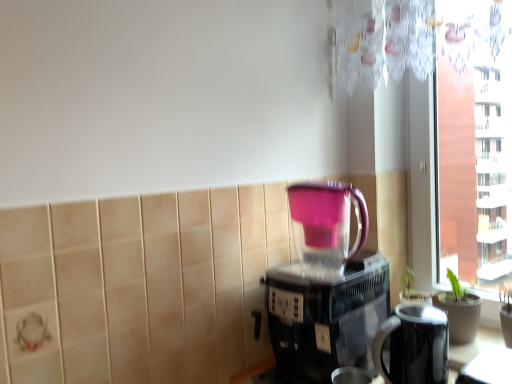
Question: Can you confirm if pink plastic blender at center is bigger than black glossy electric kettle at lower right?

Choices:
 (A) no
 (B) yes

Answer: (B)

Question: Is pink plastic blender at center smaller than black glossy electric kettle at lower right?

Choices:
 (A) no
 (B) yes

Answer: (A)

Question: Does pink plastic blender at center have a greater height compared to black glossy electric kettle at lower right?

Choices:
 (A) no
 (B) yes

Answer: (B)

Question: Can you confirm if pink plastic blender at center is shorter than black glossy electric kettle at lower right?

Choices:
 (A) yes
 (B) no

Answer: (B)

Question: From a real-world perspective, is pink plastic blender at center on black glossy electric kettle at lower right?

Choices:
 (A) yes
 (B) no

Answer: (A)

Question: From a real-world perspective, is pink plastic blender at center physically below black glossy electric kettle at lower right?

Choices:
 (A) yes
 (B) no

Answer: (B)

Question: From the image's perspective, would you say transparent glass window at right is positioned over pink plastic blender at center?

Choices:
 (A) no
 (B) yes

Answer: (B)

Question: Considering the relative sizes of transparent glass window at right and pink plastic blender at center in the image provided, is transparent glass window at right bigger than pink plastic blender at center?

Choices:
 (A) yes
 (B) no

Answer: (A)

Question: Does transparent glass window at right turn towards pink plastic blender at center?

Choices:
 (A) no
 (B) yes

Answer: (B)

Question: Is the depth of transparent glass window at right less than that of pink plastic blender at center?

Choices:
 (A) yes
 (B) no

Answer: (B)

Question: Can you confirm if transparent glass window at right is shorter than pink plastic blender at center?

Choices:
 (A) yes
 (B) no

Answer: (B)

Question: From a real-world perspective, is transparent glass window at right on top of pink plastic blender at center?

Choices:
 (A) yes
 (B) no

Answer: (A)

Question: Does black glossy electric kettle at lower right appear on the right side of black plastic coffee maker at center?

Choices:
 (A) yes
 (B) no

Answer: (A)